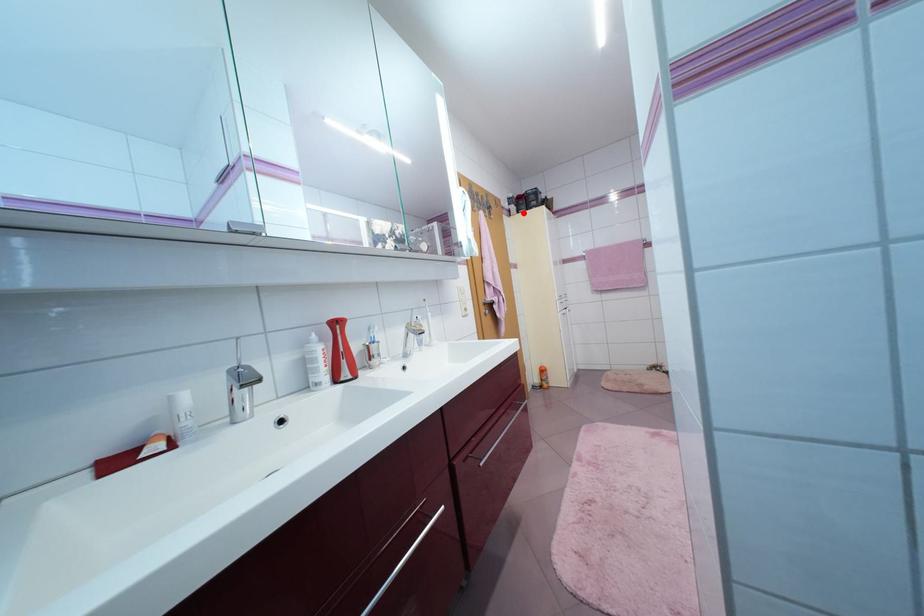
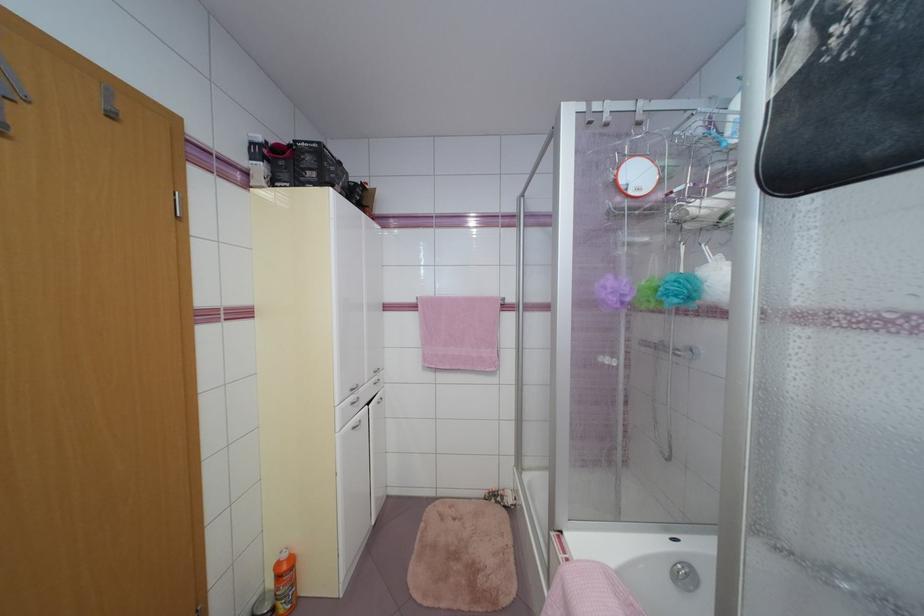
Where in the second image is the point corresponding to the highlighted location from the first image?

(276, 185)